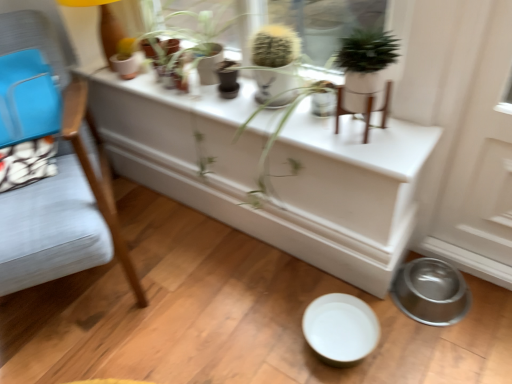
This screenshot has width=512, height=384. What are the coordinates of `vacant area that lies between light blue fabric chair at left and white glossy table at center` in the screenshot? It's located at (196, 268).